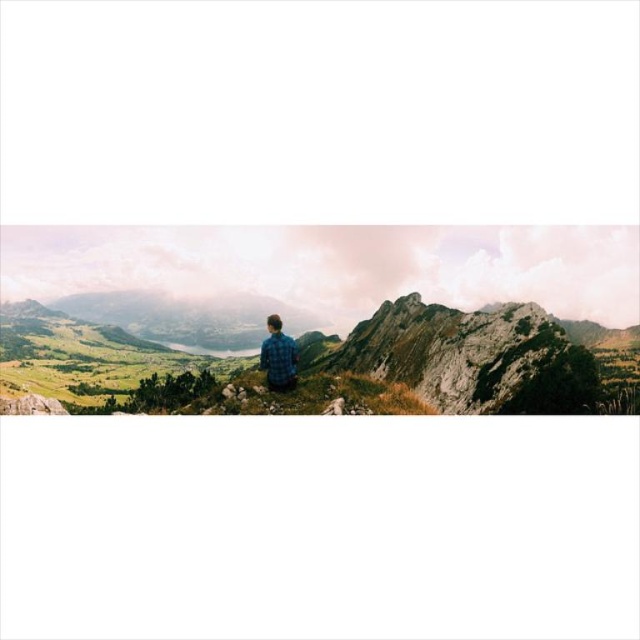
Between point (372, 371) and point (289, 378), which one is positioned behind?

Positioned behind is point (372, 371).

Where is `rugged rock peak at center`? rugged rock peak at center is located at coordinates (472, 356).

Identify the location of rugged rock peak at center. Image resolution: width=640 pixels, height=640 pixels. (472, 356).